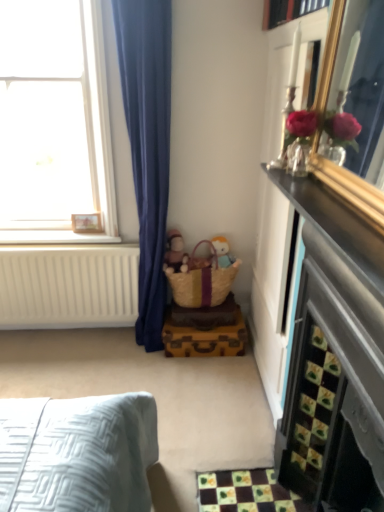
Question: From a real-world perspective, is matte brown doll at center physically located above or below yellow woven basket at center?

Choices:
 (A) below
 (B) above

Answer: (B)

Question: Considering the positions of matte brown doll at center and yellow woven basket at center in the image, is matte brown doll at center bigger or smaller than yellow woven basket at center?

Choices:
 (A) small
 (B) big

Answer: (A)

Question: Estimate the real-world distances between objects in this image. Which object is closer to the clear glass window at upper left?

Choices:
 (A) matte brown doll at center
 (B) soft plush toy at center
 (C) wooden picture frame at upper left
 (D) white painted wood at left
 (E) yellow woven basket at center

Answer: (D)

Question: Estimate the real-world distances between objects in this image. Which object is closer to the yellow woven basket at center?

Choices:
 (A) white painted wood at left
 (B) matte brown doll at center
 (C) clear glass window at upper left
 (D) wooden picture frame at upper left
 (E) soft plush toy at center

Answer: (E)